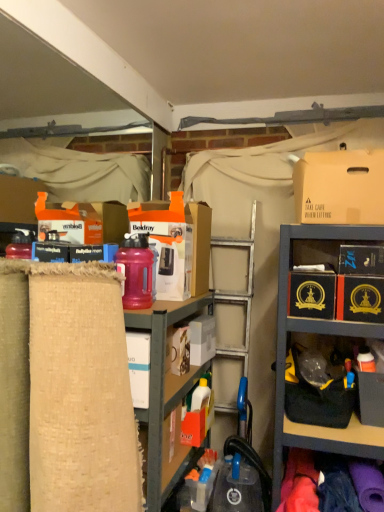
Question: Is black cardboard box at center-right, which is the third storage box in left-to-right order, beside black cardboard box at upper right, arranged as the second storage box when viewed from the right?

Choices:
 (A) no
 (B) yes

Answer: (A)

Question: Considering the relative sizes of black cardboard box at center-right, which is the third storage box in left-to-right order, and black cardboard box at upper right, the fourth storage box from the left, in the image provided, is black cardboard box at center-right, which is the third storage box in left-to-right order, smaller than black cardboard box at upper right, the fourth storage box from the left,?

Choices:
 (A) no
 (B) yes

Answer: (A)

Question: Is black cardboard box at center-right, which is the third storage box in left-to-right order, thinner than black cardboard box at upper right, the fourth storage box from the left?

Choices:
 (A) no
 (B) yes

Answer: (A)

Question: Is black cardboard box at center-right, acting as the third storage box starting from the right, to the left of black cardboard box at upper right, the fourth storage box from the left, from the viewer's perspective?

Choices:
 (A) yes
 (B) no

Answer: (A)

Question: Is black cardboard box at center-right, which is the third storage box in left-to-right order, completely or partially outside of black cardboard box at upper right, the fourth storage box from the left?

Choices:
 (A) yes
 (B) no

Answer: (A)

Question: In terms of height, does black cardboard box at center-right, which is the third storage box in left-to-right order, look taller or shorter compared to brown cardboard box at upper right?

Choices:
 (A) tall
 (B) short

Answer: (B)

Question: Considering the positions of point (317, 271) and point (306, 210), is point (317, 271) closer or farther from the camera than point (306, 210)?

Choices:
 (A) closer
 (B) farther

Answer: (B)

Question: Is black cardboard box at center-right, acting as the third storage box starting from the right, to the left or to the right of brown cardboard box at upper right in the image?

Choices:
 (A) left
 (B) right

Answer: (A)

Question: From a real-world perspective, is black cardboard box at center-right, acting as the third storage box starting from the right, above or below brown cardboard box at upper right?

Choices:
 (A) below
 (B) above

Answer: (A)

Question: From a real-world perspective, is burlap fabric at left above or below brown cardboard box at upper right?

Choices:
 (A) above
 (B) below

Answer: (B)

Question: Is point (130, 311) positioned closer to the camera than point (319, 214)?

Choices:
 (A) farther
 (B) closer

Answer: (B)

Question: Is burlap fabric at left spatially inside brown cardboard box at upper right, or outside of it?

Choices:
 (A) inside
 (B) outside

Answer: (B)

Question: From the image's perspective, is burlap fabric at left above or below brown cardboard box at upper right?

Choices:
 (A) above
 (B) below

Answer: (B)

Question: Considering the positions of pink matte water bottle at center-left and black cardboard box at center-right, acting as the third storage box starting from the right, in the image, is pink matte water bottle at center-left taller or shorter than black cardboard box at center-right, acting as the third storage box starting from the right,?

Choices:
 (A) tall
 (B) short

Answer: (A)

Question: Is pink matte water bottle at center-left inside or outside of black cardboard box at center-right, acting as the third storage box starting from the right?

Choices:
 (A) outside
 (B) inside

Answer: (A)